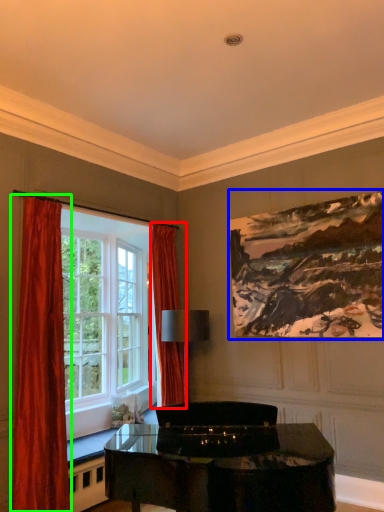
Question: Estimate the real-world distances between objects in this image. Which object is farther from curtain (highlighted by a red box), picture frame (highlighted by a blue box) or curtain (highlighted by a green box)?

Choices:
 (A) picture frame
 (B) curtain

Answer: (B)